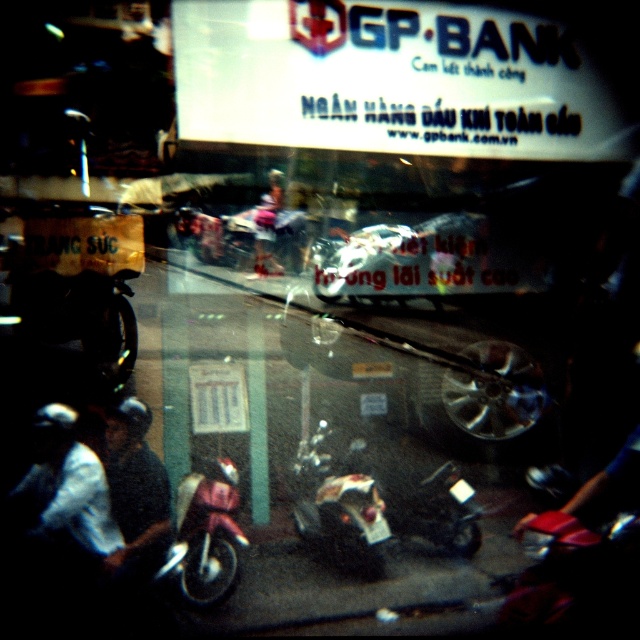
Question: Does shiny chrome motorcycle at center have a lesser width compared to matte pink helmet at center?

Choices:
 (A) yes
 (B) no

Answer: (B)

Question: In this image, where is shiny chrome motorcycle at center located relative to matte pink helmet at center?

Choices:
 (A) below
 (B) above

Answer: (A)

Question: Does shiny chrome motorcycle at center have a larger size compared to matte pink helmet at center?

Choices:
 (A) yes
 (B) no

Answer: (A)

Question: Which point is farther to the camera?

Choices:
 (A) (349, 552)
 (B) (278, 188)

Answer: (A)